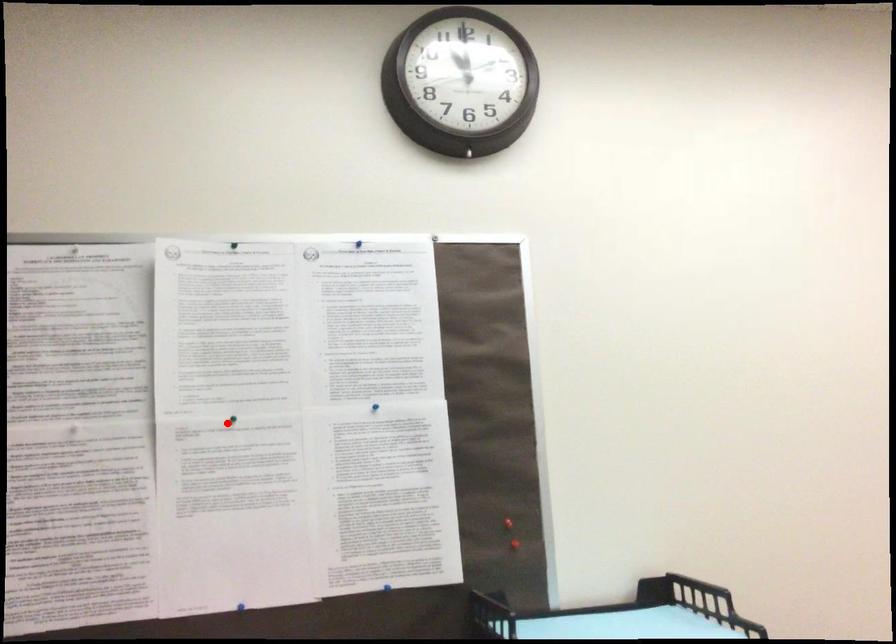
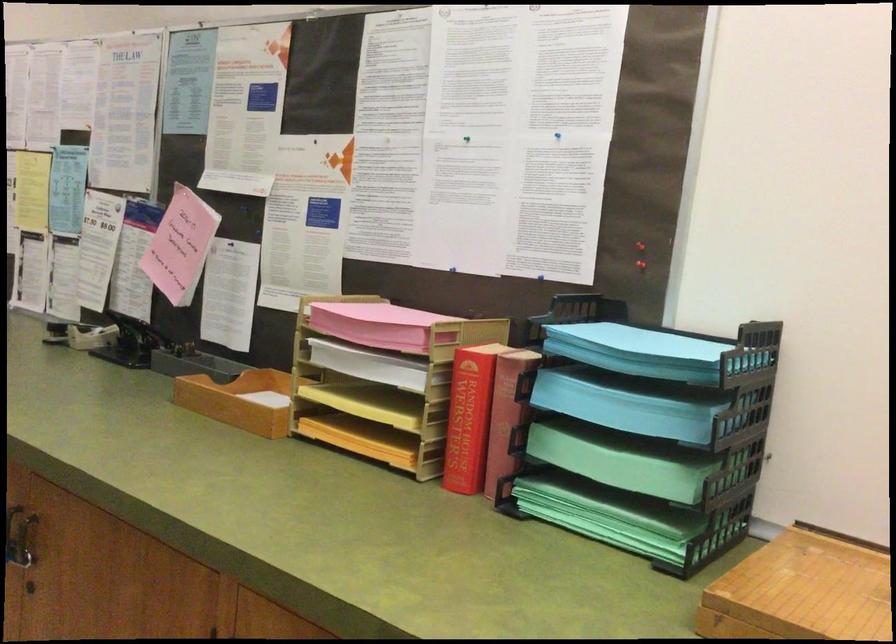
Locate, in the second image, the point that corresponds to the highlighted location in the first image.

(467, 138)